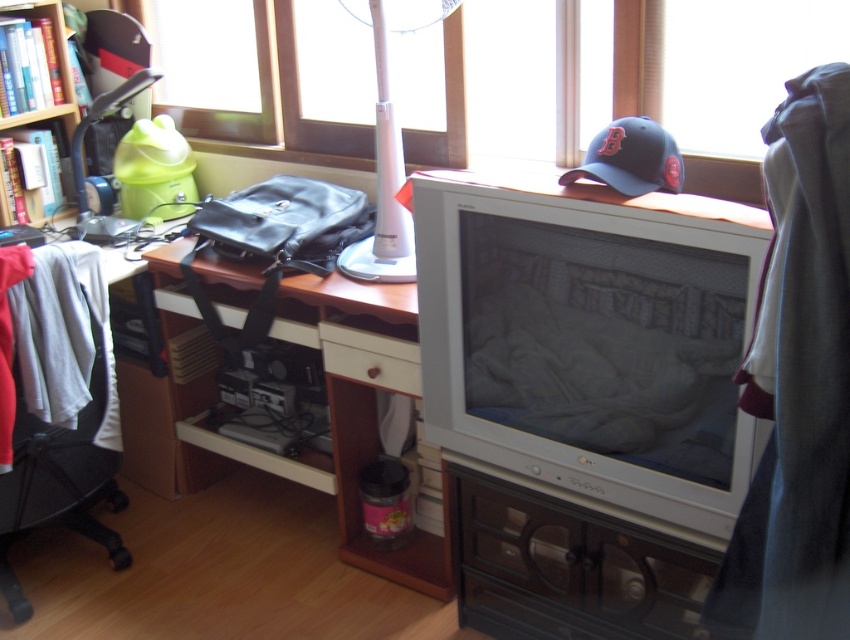
You are organizing your study area and need to place a new bookshelf. The wooden bookcase at upper left is already in place. Where should you position the new bookshelf if you want it to be on the left side of the white wood drawer at center?

You should place the new bookshelf to the left of the white wood drawer at center since the wooden bookcase at upper left is already positioned to its left.

You are standing at the center of the room and want to move towards the black fabric swivel chair at left. Which direction should you move in?

You should move towards the left direction to reach the black fabric swivel chair at left since it is located at point (x=60, y=404), which is to the left side of the room.

You are sitting in the black fabric swivel chair at left and want to reach the white plastic lamp at upper center on your desk. Which direction should you turn to face the lamp?

Since the black fabric swivel chair at left is to the left of the white plastic lamp at upper center, you should turn to your right to face the lamp.